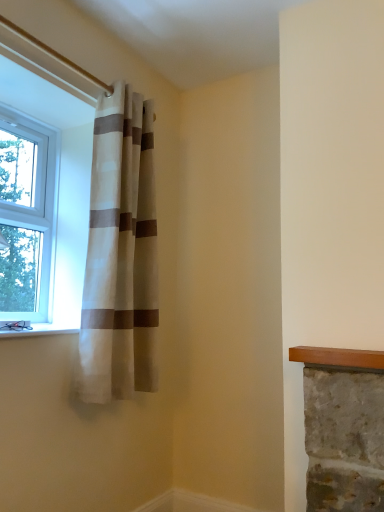
Question: Can you confirm if beige/white striped curtain at upper left is thinner than clear glass window at left?

Choices:
 (A) yes
 (B) no

Answer: (B)

Question: Would you consider beige/white striped curtain at upper left to be distant from clear glass window at left?

Choices:
 (A) yes
 (B) no

Answer: (B)

Question: Is beige/white striped curtain at upper left positioned with its back to clear glass window at left?

Choices:
 (A) no
 (B) yes

Answer: (B)

Question: From a real-world perspective, is beige/white striped curtain at upper left on clear glass window at left?

Choices:
 (A) no
 (B) yes

Answer: (A)

Question: Considering the relative sizes of beige/white striped curtain at upper left and clear glass window at left in the image provided, is beige/white striped curtain at upper left wider than clear glass window at left?

Choices:
 (A) no
 (B) yes

Answer: (B)

Question: From their relative heights in the image, would you say beige/white striped curtain at upper left is taller or shorter than white stone window sill at lower left?

Choices:
 (A) tall
 (B) short

Answer: (A)

Question: From a real-world perspective, is beige/white striped curtain at upper left above or below white stone window sill at lower left?

Choices:
 (A) above
 (B) below

Answer: (A)

Question: Looking at their shapes, would you say beige/white striped curtain at upper left is wider or thinner than white stone window sill at lower left?

Choices:
 (A) thin
 (B) wide

Answer: (A)

Question: Is point (99, 211) closer or farther from the camera than point (38, 323)?

Choices:
 (A) closer
 (B) farther

Answer: (A)

Question: Is clear glass window at left to the left or to the right of beige/white striped curtain at upper left in the image?

Choices:
 (A) right
 (B) left

Answer: (B)

Question: From the image's perspective, is clear glass window at left above or below beige/white striped curtain at upper left?

Choices:
 (A) below
 (B) above

Answer: (B)

Question: Considering the positions of clear glass window at left and beige/white striped curtain at upper left in the image, is clear glass window at left bigger or smaller than beige/white striped curtain at upper left?

Choices:
 (A) small
 (B) big

Answer: (A)

Question: In terms of width, does clear glass window at left look wider or thinner when compared to beige/white striped curtain at upper left?

Choices:
 (A) thin
 (B) wide

Answer: (A)

Question: Is white stone window sill at lower left bigger or smaller than beige/white striped curtain at upper left?

Choices:
 (A) small
 (B) big

Answer: (A)

Question: From the image's perspective, relative to beige/white striped curtain at upper left, is white stone window sill at lower left above or below?

Choices:
 (A) below
 (B) above

Answer: (A)